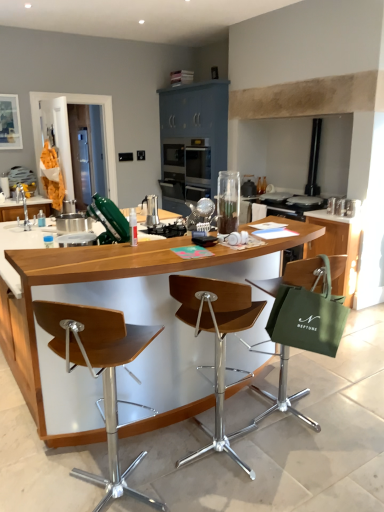
Find the location of a particular element. The height and width of the screenshot is (512, 384). free spot in front of green fabric chair at right, which ranks as the 3th chair in left-to-right order is located at coordinates pos(313,459).